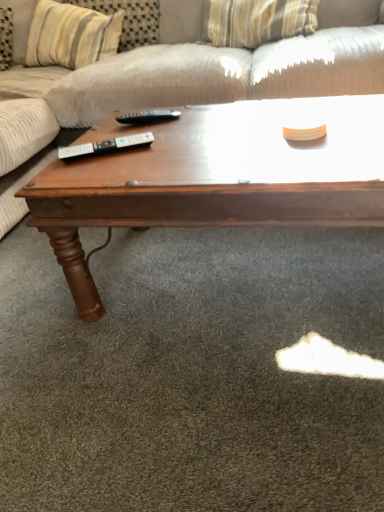
The width and height of the screenshot is (384, 512). In order to click on empty space that is ontop of dark wood coffee table at center (from a real-world perspective) in this screenshot , I will do point(203,136).